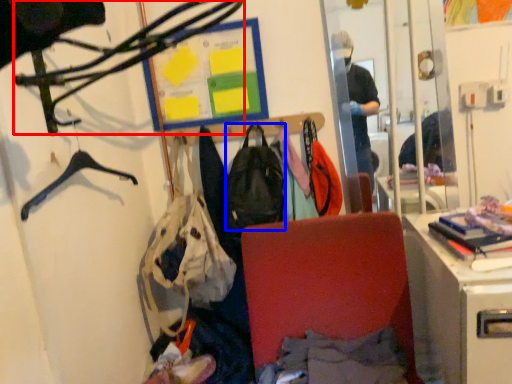
Question: Among these objects, which one is farthest to the camera, hanger (highlighted by a red box) or backpack (highlighted by a blue box)?

Choices:
 (A) hanger
 (B) backpack

Answer: (B)